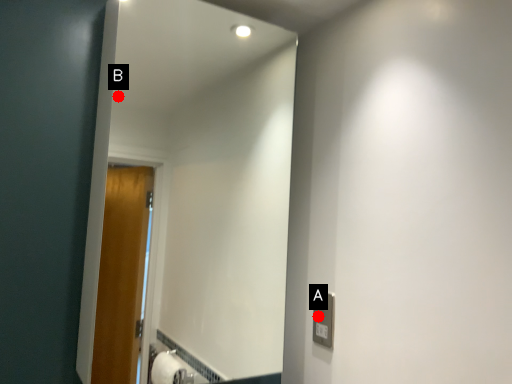
Question: Two points are circled on the image, labeled by A and B beside each circle. Which point is closer to the camera taking this photo?

Choices:
 (A) A is closer
 (B) B is closer

Answer: (A)